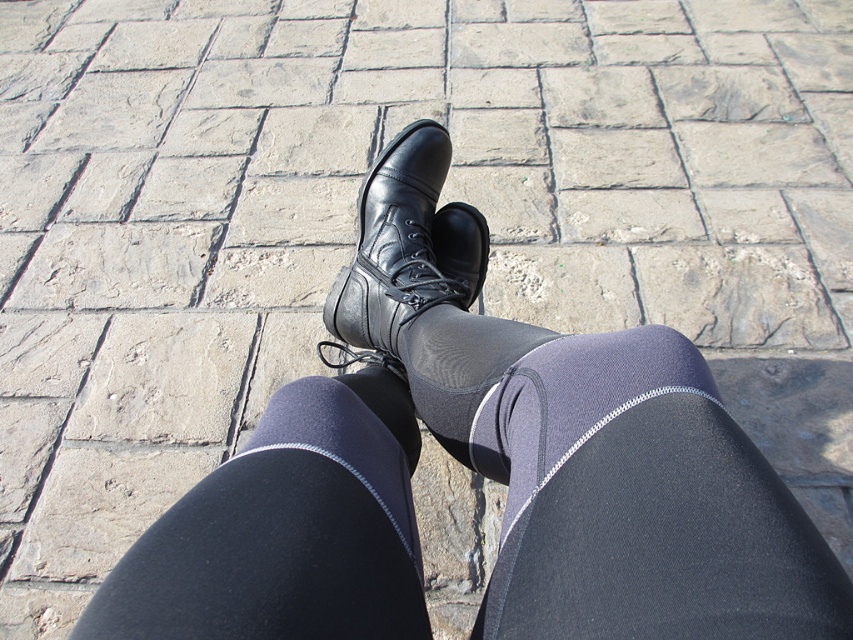
Question: Which is farther from the black leather shoe at center?

Choices:
 (A) black matte sock at center
 (B) matte black leggings at center

Answer: (B)

Question: Does black leather shoe at center lie behind black matte sock at center?

Choices:
 (A) yes
 (B) no

Answer: (A)

Question: Is black leather shoe at center to the right of black matte sock at center from the viewer's perspective?

Choices:
 (A) yes
 (B) no

Answer: (A)

Question: Which of the following is the farthest from the observer?

Choices:
 (A) (135, 634)
 (B) (383, 406)

Answer: (B)

Question: Is matte black leggings at center to the right of black matte sock at center from the viewer's perspective?

Choices:
 (A) yes
 (B) no

Answer: (A)

Question: Estimate the real-world distances between objects in this image. Which object is farther from the matte black leggings at center?

Choices:
 (A) black leather shoe at center
 (B) black matte sock at center

Answer: (A)